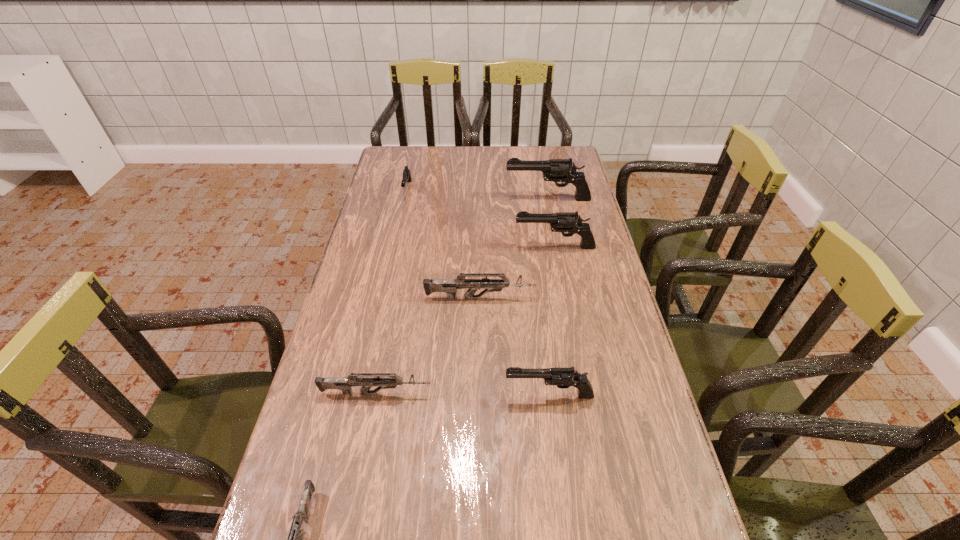
Identify the location of vacant region located aimed along the barrel of the second nearest grey gun. (563, 393).

Identify the location of blank space at the far edge of the desktop. The width and height of the screenshot is (960, 540). (476, 170).

The width and height of the screenshot is (960, 540). Identify the location of vacant space at the left edge of the desktop. (353, 290).

I want to click on vacant area at the right edge of the desktop, so click(625, 326).

At what (x,y) coordinates should I click in order to perform the action: click on free space at the far left corner of the desktop. Please return your answer as a coordinate pair (x, y). The height and width of the screenshot is (540, 960). Looking at the image, I should click on (421, 163).

The image size is (960, 540). What are the coordinates of `free space between the second tallest object and the farthest grey gun` in the screenshot? It's located at (517, 273).

Image resolution: width=960 pixels, height=540 pixels. I want to click on empty space that is in between the farthest grey gun and the tallest gun, so click(514, 248).

Identify the location of free spot between the smallest black gun and the second biggest grey gun. The width and height of the screenshot is (960, 540). pos(392,292).

The height and width of the screenshot is (540, 960). In order to click on free point between the tallest gun and the leftmost black gun in this screenshot , I will do `click(478, 194)`.

Identify the location of free space that is in between the smallest black gun and the second biggest grey gun. Image resolution: width=960 pixels, height=540 pixels. (392, 292).